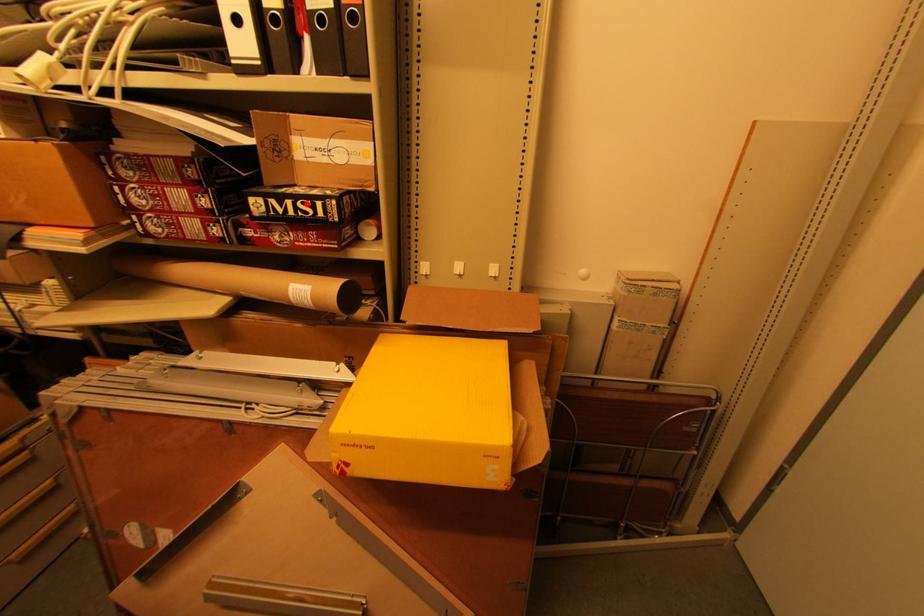
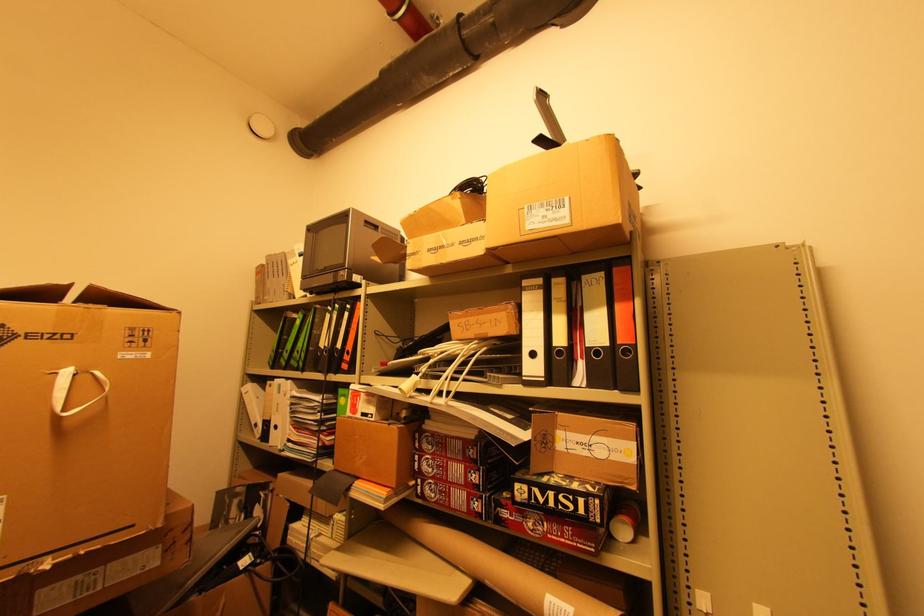
Find the pixel in the second image that matches the highlighted location in the first image.

(568, 498)